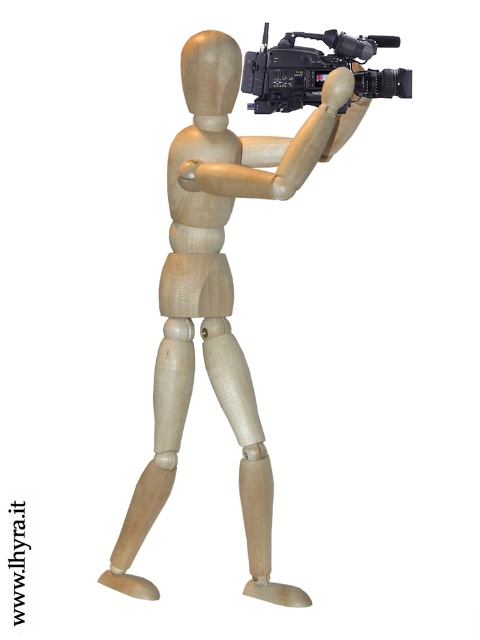
Question: Does natural wood mannequin at center have a smaller size compared to black plastic video camera at upper center?

Choices:
 (A) yes
 (B) no

Answer: (B)

Question: Which of the following is the farthest from the observer?

Choices:
 (A) black plastic video camera at upper center
 (B) natural wood mannequin at center

Answer: (A)

Question: Which object appears farthest from the camera in this image?

Choices:
 (A) black plastic video camera at upper center
 (B) natural wood mannequin at center

Answer: (A)

Question: Does natural wood mannequin at center have a lesser width compared to black plastic video camera at upper center?

Choices:
 (A) no
 (B) yes

Answer: (A)

Question: Which point is farther from the camera taking this photo?

Choices:
 (A) (313, 161)
 (B) (264, 61)

Answer: (B)

Question: Does natural wood mannequin at center have a greater width compared to black plastic video camera at upper center?

Choices:
 (A) no
 (B) yes

Answer: (B)